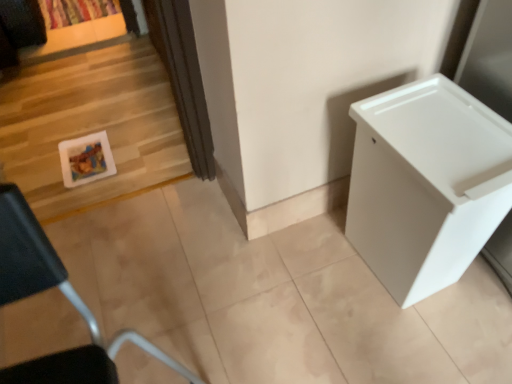
Identify the location of free space in front of white plastic changing table at right. The height and width of the screenshot is (384, 512). coord(418,339).